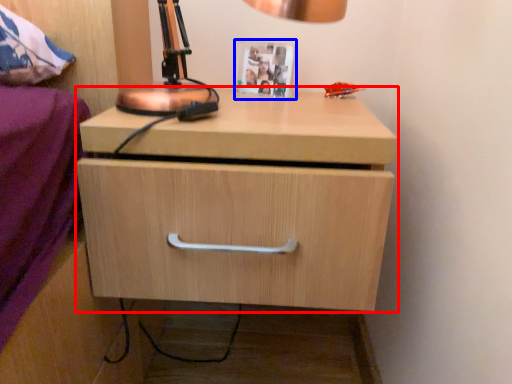
Question: Which of the following is the farthest to the observer, chest of drawers (highlighted by a red box) or picture frame (highlighted by a blue box)?

Choices:
 (A) chest of drawers
 (B) picture frame

Answer: (B)